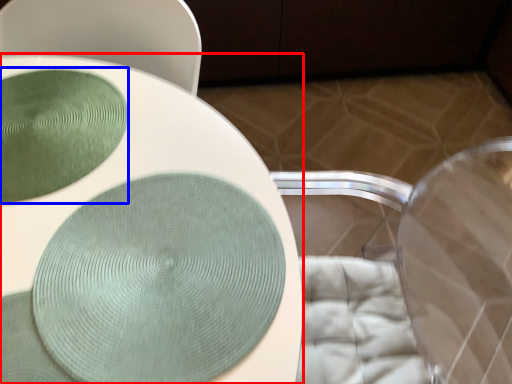
Question: Which object appears farthest to the camera in this image, toilet (highlighted by a red box) or glass plate (highlighted by a blue box)?

Choices:
 (A) toilet
 (B) glass plate

Answer: (B)